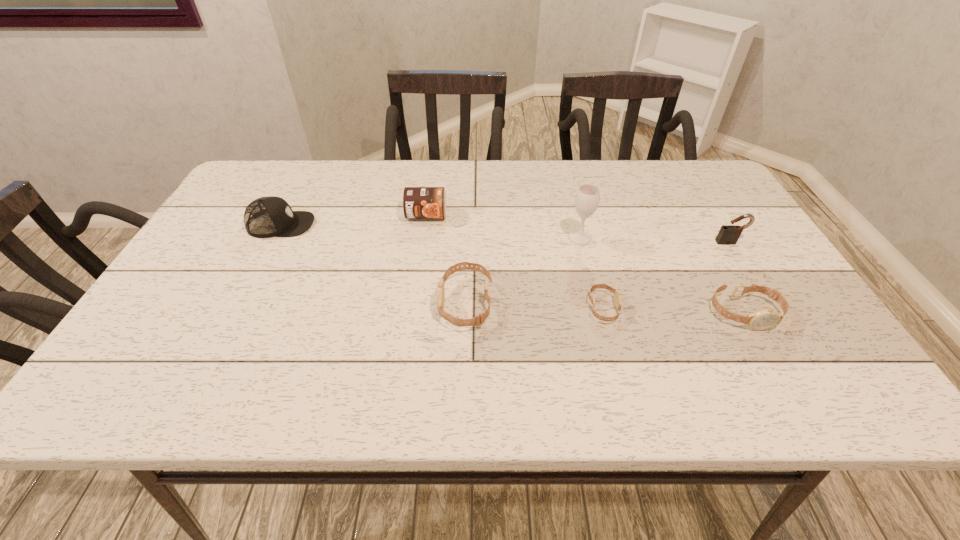
Observe the arrangement of all watchs in the image. To keep them evenly spaced, where would you place another watch on the left? Please locate a free space. Please provide its 2D coordinates. Your answer should be formatted as a tuple, i.e. [(x, y)], where the tuple contains the x and y coordinates of a point satisfying the conditions above.

[(330, 299)]